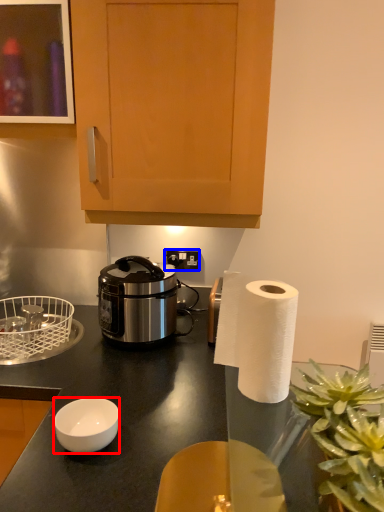
Question: Among these objects, which one is farthest to the camera, bowl (highlighted by a red box) or power outlet (highlighted by a blue box)?

Choices:
 (A) bowl
 (B) power outlet

Answer: (B)